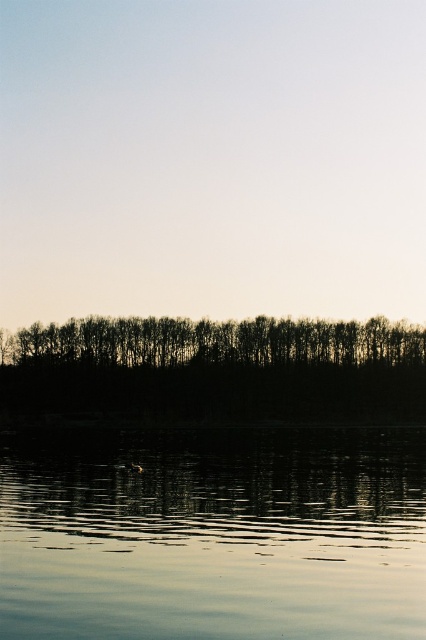
You are standing at the edge of the water and want to take a photo of both the smooth reflective water at bottom and the black silhouetted trees at center. Since the water is to the right of the trees, where should you position yourself to capture both in the frame?

To capture both the smooth reflective water at bottom and the black silhouetted trees at center in the frame, you should position yourself to the left of the black silhouetted trees at center so that the smooth reflective water at bottom is visible to the right of them in the photo.